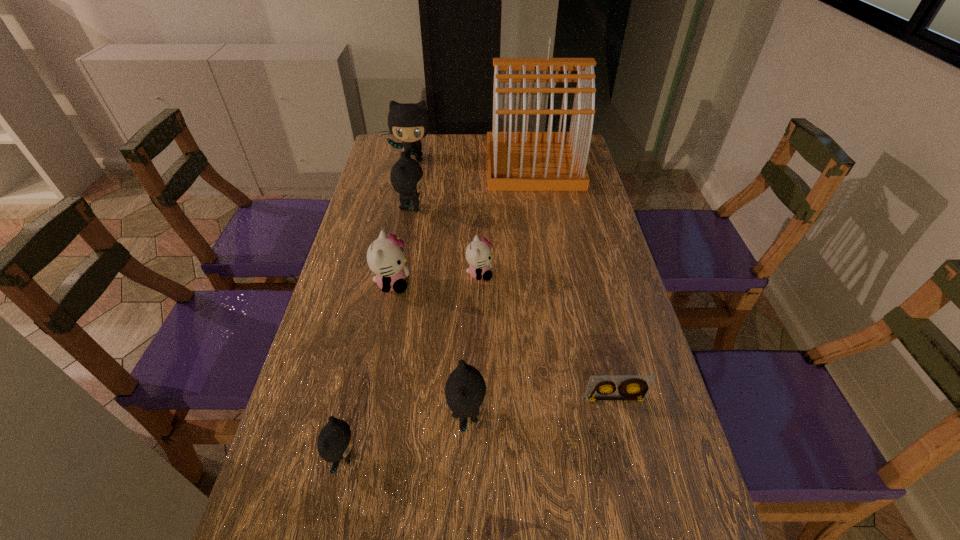
Locate an element on the screen. empty space that is in between the rightmost gray kitten and the second biggest gray kitten is located at coordinates (439, 312).

This screenshot has height=540, width=960. Find the location of `vacant area between the second smallest gray kitten and the smallest gray kitten`. vacant area between the second smallest gray kitten and the smallest gray kitten is located at coordinates (405, 436).

Identify the location of vacant point located between the bigger white kitten and the shortest object. (503, 341).

Where is `empty location between the left white kitten and the second smallest gray kitten`? empty location between the left white kitten and the second smallest gray kitten is located at coordinates (429, 349).

Find the location of a particular element. This screenshot has width=960, height=540. free space that is in between the fifth nearest kitten and the right white kitten is located at coordinates [x=445, y=241].

Locate an element on the screen. empty location between the tallest kitten and the left white kitten is located at coordinates (403, 221).

At what (x,y) coordinates should I click in order to perform the action: click on vacant point located between the bigger white kitten and the right white kitten. Please return your answer as a coordinate pair (x, y). Looking at the image, I should click on (436, 279).

At what (x,y) coordinates should I click in order to perform the action: click on free spot between the right white kitten and the shortest object. Please return your answer as a coordinate pair (x, y). Looking at the image, I should click on (547, 336).

Identify the location of object that is the closest to the videotape. The height and width of the screenshot is (540, 960). (465, 391).

Locate an element on the screen. The width and height of the screenshot is (960, 540). object identified as the fourth closest to the right white kitten is located at coordinates (516, 161).